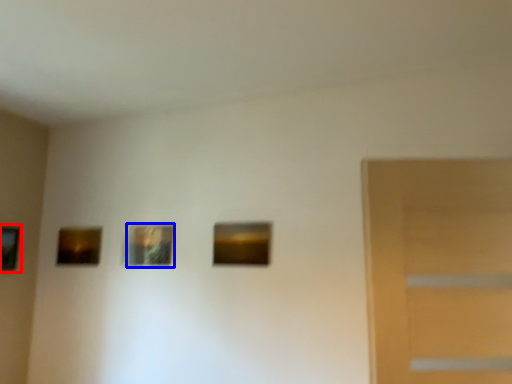
Question: Which of the following is the closest to the observer, picture frame (highlighted by a red box) or picture frame (highlighted by a blue box)?

Choices:
 (A) picture frame
 (B) picture frame

Answer: (A)